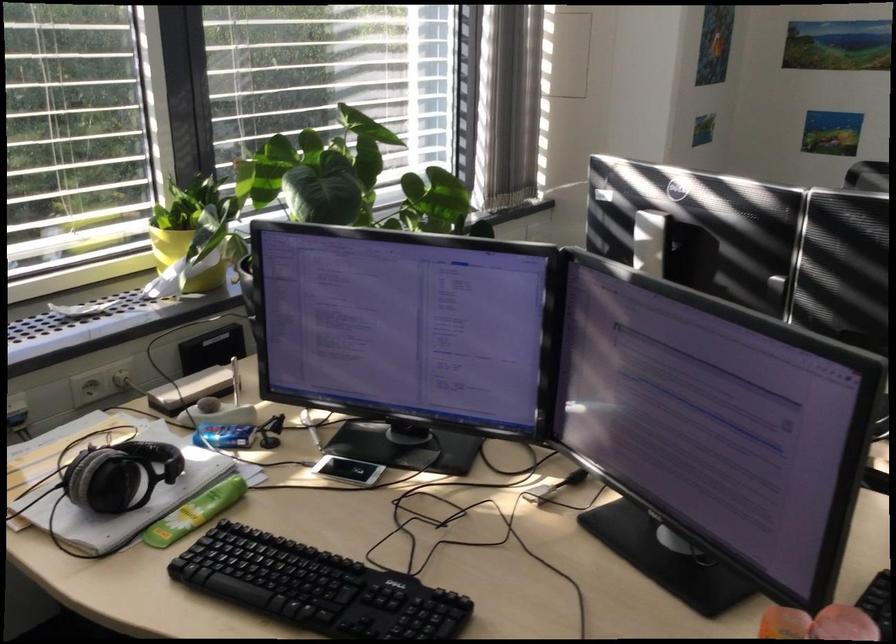
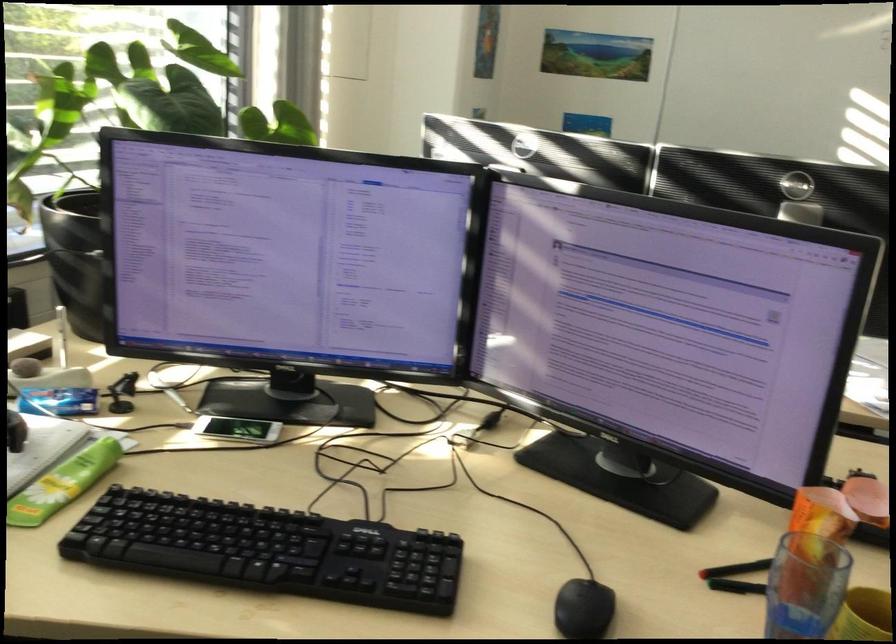
Locate, in the second image, the point that corresponds to the point at 204,506 in the first image.

(64, 483)